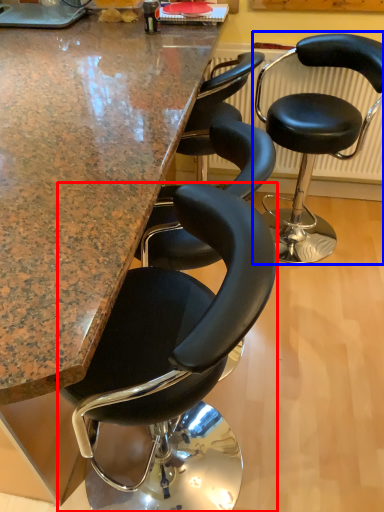
Question: Which point is closer to the camera, chair (highlighted by a red box) or chair (highlighted by a blue box)?

Choices:
 (A) chair
 (B) chair

Answer: (A)